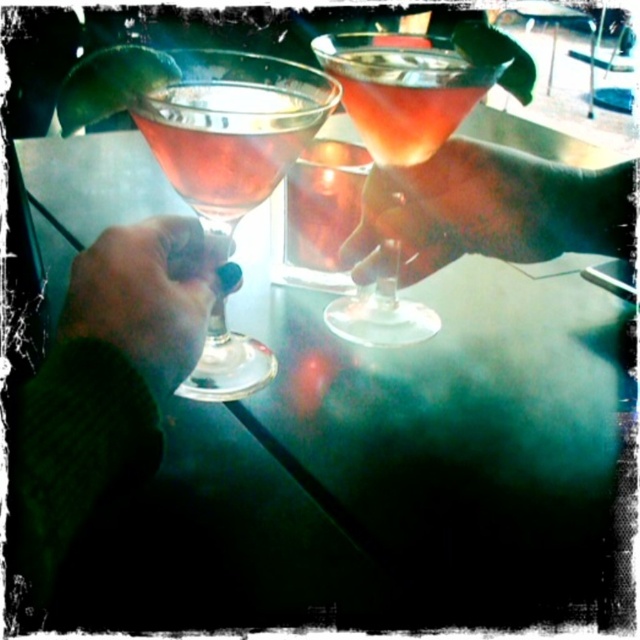
You are a bartender trying to place a coaster under the matte glass at left. The coaster is 5 cm in diameter. Can you fit it under the glass without overlapping the table edge or other objects?

The matte glass at left is located at point (227, 140), but without knowing the table dimensions or nearby objects, it is impossible to determine if the coaster will fit without overlapping. More information is needed.

You are a photographer adjusting the focus on your camera. You want to ensure both the translucent glass martini at center and the matte black hand at lower left are in focus. Which object should you focus on first to achieve this?

You should focus on the translucent glass martini at center first because it is closer to the viewer than the matte black hand at lower left, ensuring both are in focus by starting with the closer object.

You are at a party and see two glasses on the table. The glasses are the matte glass at left and the translucent glass drink at center. If you want to grab the glass that is on the right side, which one should you choose?

The translucent glass drink at center is on the right side of the matte glass at left, so you should choose the translucent glass drink at center.